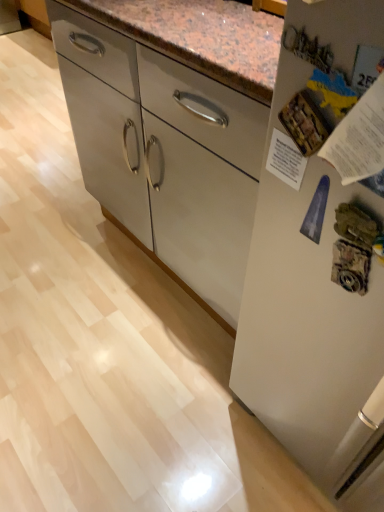
The height and width of the screenshot is (512, 384). Describe the element at coordinates (359, 138) in the screenshot. I see `white paper at upper right` at that location.

This screenshot has height=512, width=384. In order to click on white paper at upper right in this screenshot , I will do `click(359, 138)`.

I want to click on white paper at upper right, so (359, 138).